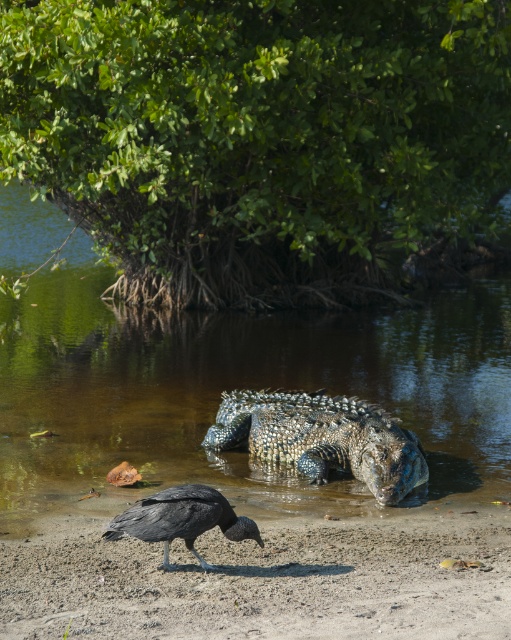
Question: Can you confirm if clear water at center is smaller than shiny black bird at lower center?

Choices:
 (A) yes
 (B) no

Answer: (B)

Question: Which point appears farthest from the camera in this image?

Choices:
 (A) (394, 440)
 (B) (149, 520)
 (C) (267, 589)

Answer: (A)

Question: Does clear water at center appear over shiny black bird at lower center?

Choices:
 (A) no
 (B) yes

Answer: (B)

Question: Estimate the real-world distances between objects in this image. Which object is closer to the black matte bird at lower left?

Choices:
 (A) shiny scaly crocodile at center
 (B) clear water at center

Answer: (A)

Question: Considering the relative positions of black matte bird at lower left and shiny black bird at lower center in the image provided, where is black matte bird at lower left located with respect to shiny black bird at lower center?

Choices:
 (A) right
 (B) left

Answer: (A)

Question: Which object is positioned farthest from the shiny scaly crocodile at center?

Choices:
 (A) black matte bird at lower left
 (B) shiny black bird at lower center
 (C) clear water at center

Answer: (C)